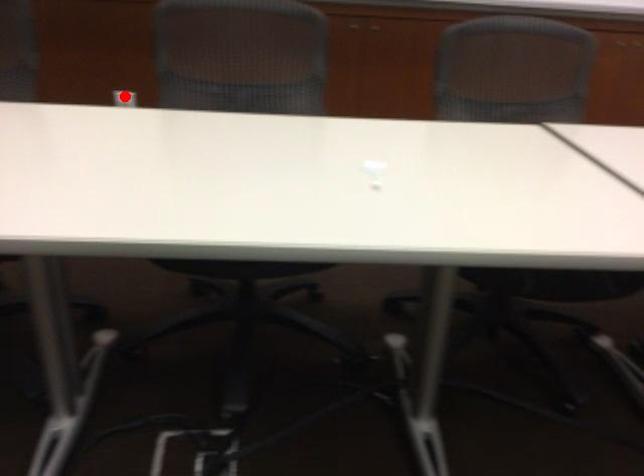
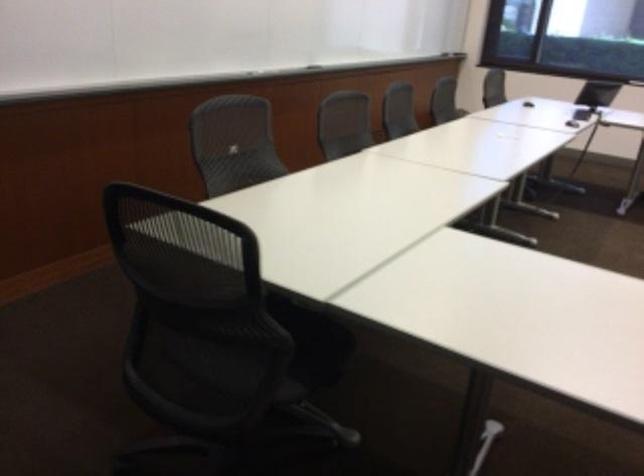
Question: I am providing you with two images of the same scene from different viewpoints. A red point is marked on the first image. Is the red point's position out of view in image 2?

Choices:
 (A) Yes
 (B) No

Answer: (A)